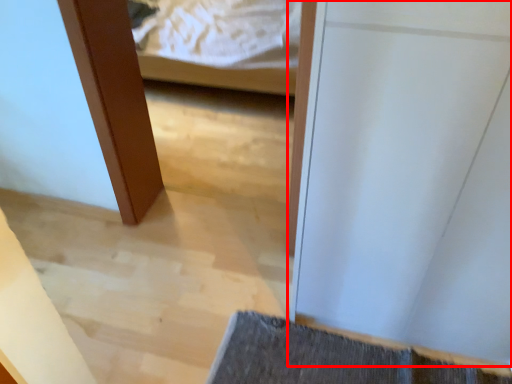
Question: From the image's perspective, considering the relative positions of door (annotated by the red box) and bath mat in the image provided, where is door (annotated by the red box) located with respect to the staircase?

Choices:
 (A) above
 (B) below

Answer: (A)